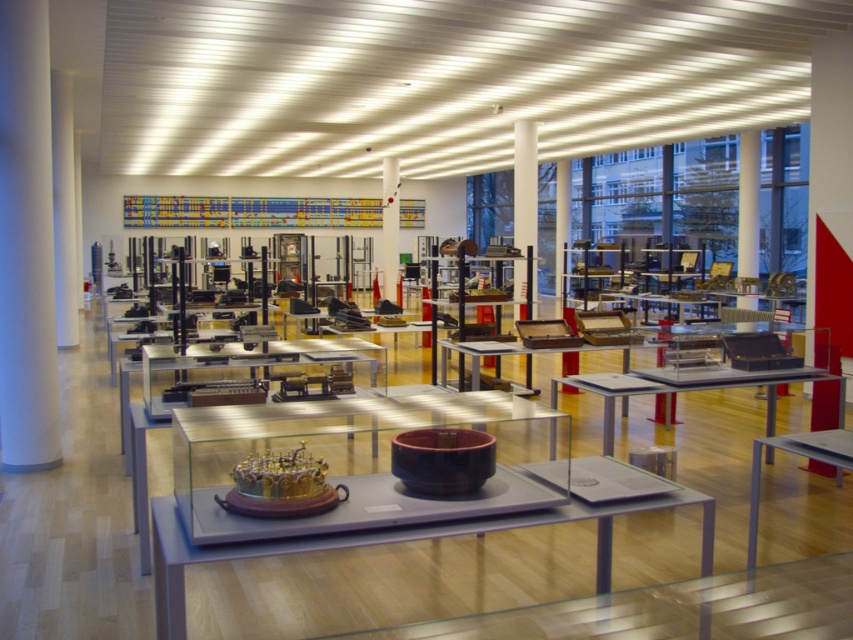
Is point (167, 628) positioned before point (502, 342)?

That is True.

Is matte gray table at center wider than wooden table at center?

Yes, matte gray table at center is wider than wooden table at center.

Identify the location of matte gray table at center. (392, 541).

This screenshot has height=640, width=853. Find the location of `matte gray table at center`. matte gray table at center is located at coordinates (392, 541).

Which is more to the right, transparent glass table at center or wooden table at center?

From the viewer's perspective, wooden table at center appears more on the right side.

Can you confirm if transparent glass table at center is positioned below wooden table at center?

Yes.

What do you see at coordinates (368, 461) in the screenshot? Image resolution: width=853 pixels, height=640 pixels. I see `transparent glass table at center` at bounding box center [368, 461].

Image resolution: width=853 pixels, height=640 pixels. Identify the location of transparent glass table at center. (368, 461).

Which is more to the right, metallic silver table at center or white glossy pillar at center?

Positioned to the right is metallic silver table at center.

Can you confirm if metallic silver table at center is shorter than white glossy pillar at center?

Yes.

Is point (693, 369) positioned behind point (384, 252)?

No, it is not.

At what (x,y) coordinates should I click in order to perform the action: click on metallic silver table at center. Please return your answer as a coordinate pair (x, y). Looking at the image, I should click on (689, 388).